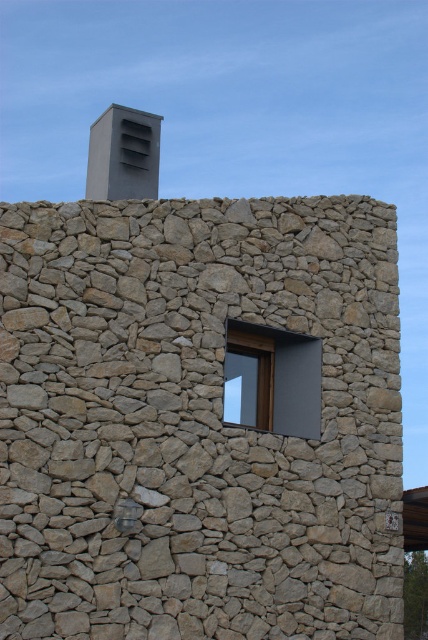
You are an architect designing a new building and want to ensure proper ventilation. The building has a natural stone wall at center and a gray matte chimney at upper center. Based on their positions, which object is located higher up in the image?

The gray matte chimney at upper center is located higher up in the image than the natural stone wall at center.

You are an architect analyzing the structural integrity of the natural stone wall at center. Based on its position at coordinates point 0.658, 0.467, what is the recommended minimum distance in meters between support beams to ensure stability?

The natural stone wall at center is positioned at point (199, 420). To ensure stability, support beams should be placed at intervals not exceeding 2 meters apart.

You are an architect reviewing the building design. You need to determine the spatial relationship between the matte gray window at center and the gray matte chimney at upper center. Which object is positioned to the left of the other?

The matte gray window at center is to the right of the gray matte chimney at upper center, so the gray matte chimney at upper center is positioned to the left of the matte gray window at center.